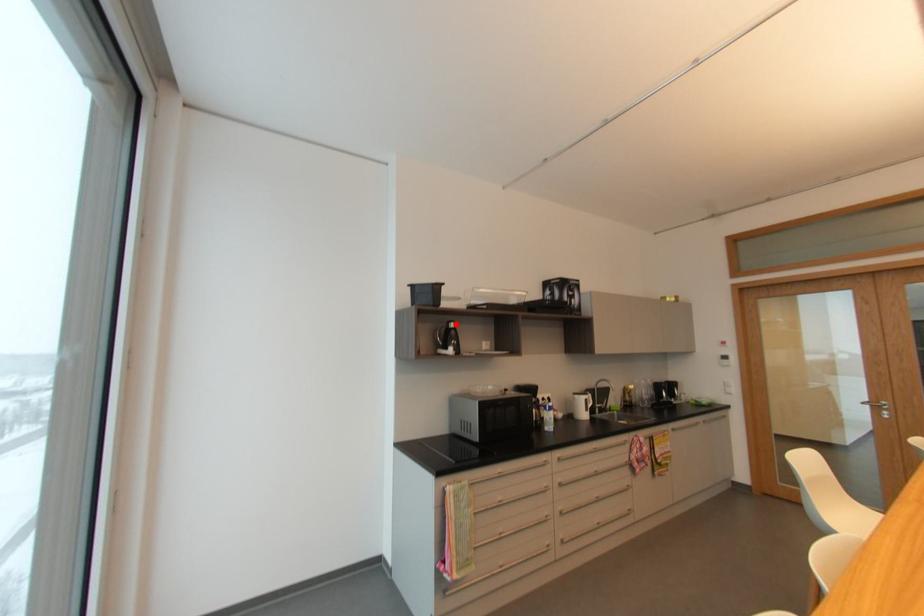
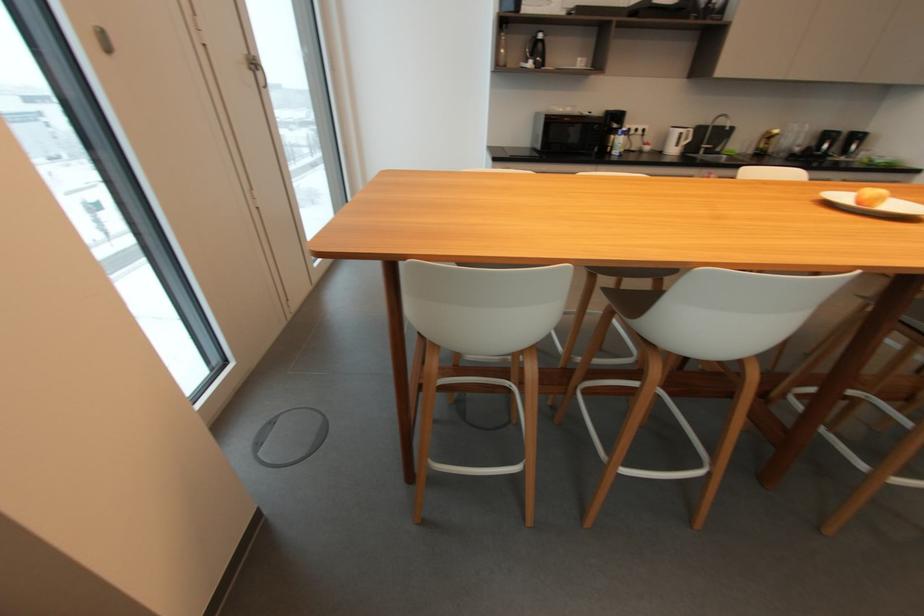
In the second image, find the point that corresponds to the highlighted location in the first image.

(544, 36)